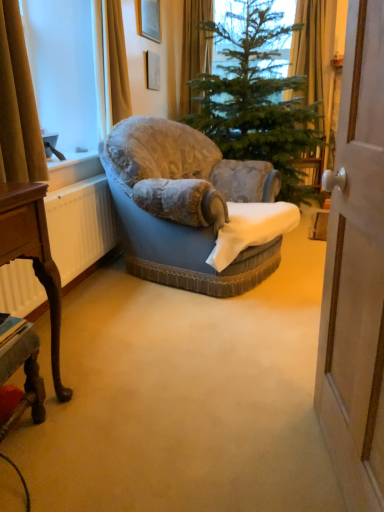
The width and height of the screenshot is (384, 512). In order to click on free space that is in between velvet blue armchair at center and white matte radiator at left in this screenshot , I will do `click(126, 312)`.